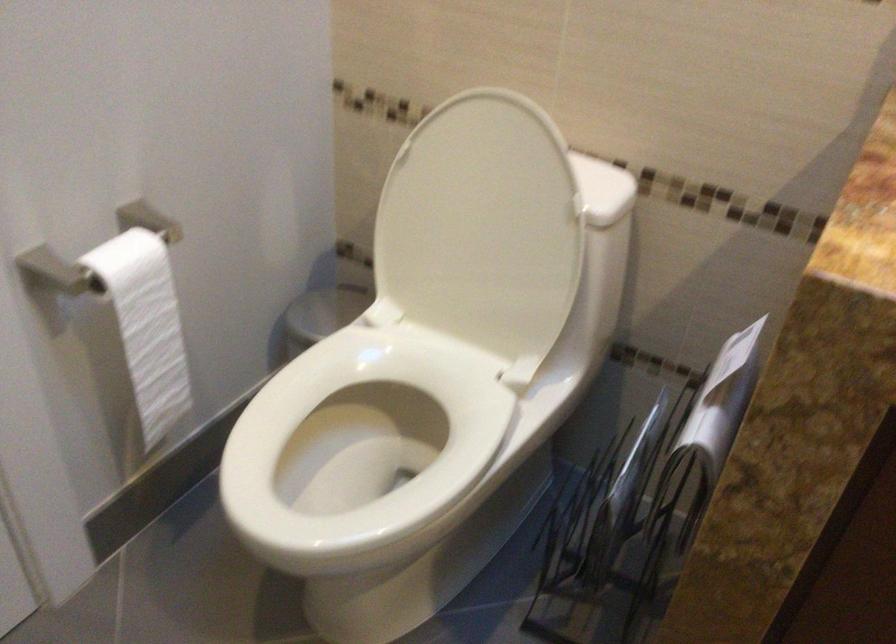
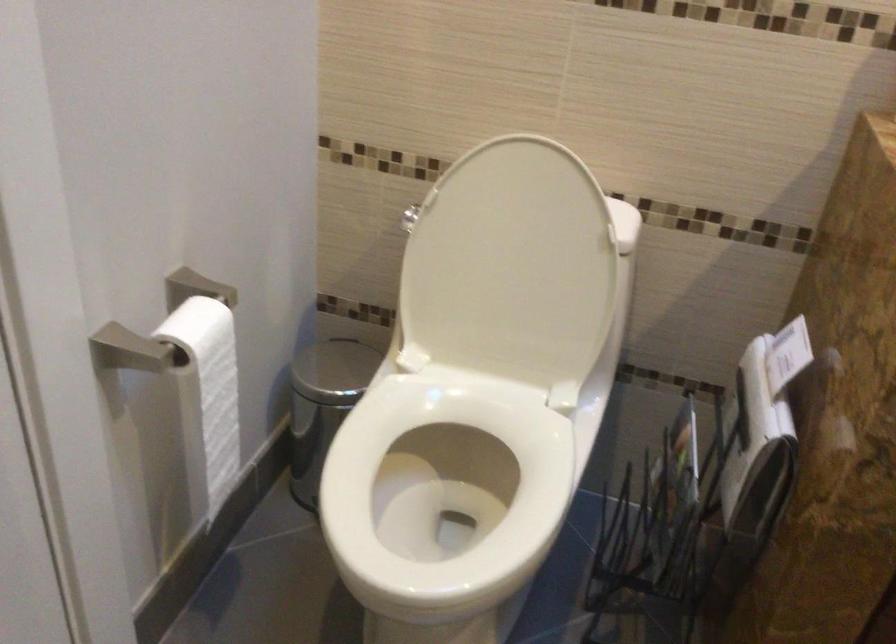
Question: How did the camera likely rotate?

Choices:
 (A) Left
 (B) Right
 (C) Up
 (D) Down

Answer: (B)